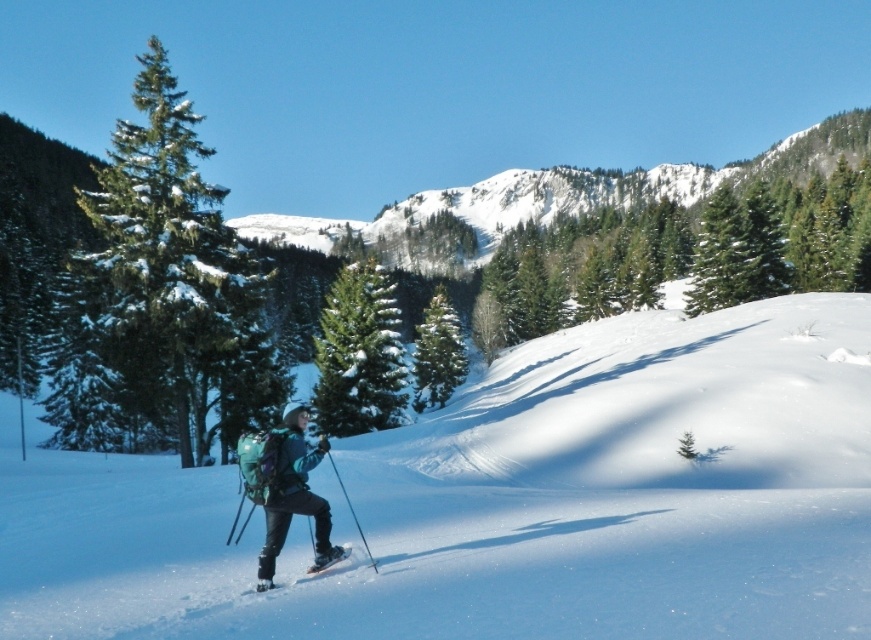
Is matte blue jacket at center to the left of green textured pine tree at center from the viewer's perspective?

Correct, you'll find matte blue jacket at center to the left of green textured pine tree at center.

Which is more to the left, matte blue jacket at center or green textured pine tree at center?

From the viewer's perspective, matte blue jacket at center appears more on the left side.

Locate an element on the screen. This screenshot has height=640, width=871. matte blue jacket at center is located at coordinates (287, 488).

Which is in front, point (396, 330) or point (341, 550)?

Point (341, 550) is in front.

How far apart are green textured pine at center and shiny black ski at lower center?

They are 45.89 meters apart.

Is point (358, 301) farther from viewer compared to point (338, 556)?

Yes, it is.

In order to click on green textured pine at center in this screenshot , I will do `click(359, 355)`.

Does point (426, 396) lie in front of point (348, 552)?

No, (426, 396) is behind (348, 552).

You are a GUI agent. You are given a task and a screenshot of the screen. Output one action in this format:
    pyautogui.click(x=<x>, y=<y>)
    Task: Click on the green textured pine tree at center
    
    Given the screenshot: What is the action you would take?
    pyautogui.click(x=437, y=353)